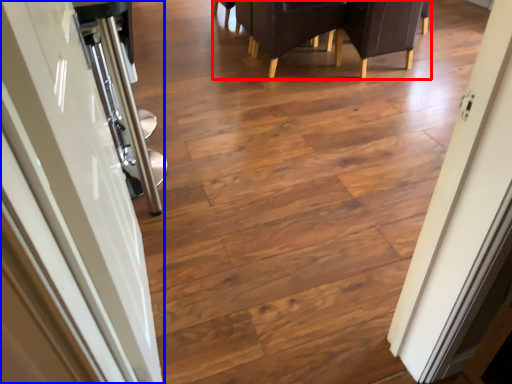
Question: Which object appears closest to the camera in this image, furniture (highlighted by a red box) or door (highlighted by a blue box)?

Choices:
 (A) furniture
 (B) door

Answer: (B)